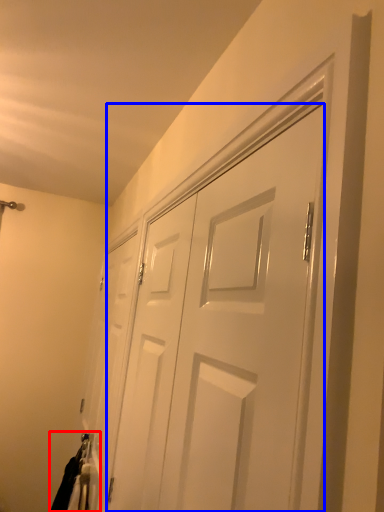
Question: Among these objects, which one is farthest to the camera, laundry (highlighted by a red box) or door (highlighted by a blue box)?

Choices:
 (A) laundry
 (B) door

Answer: (A)